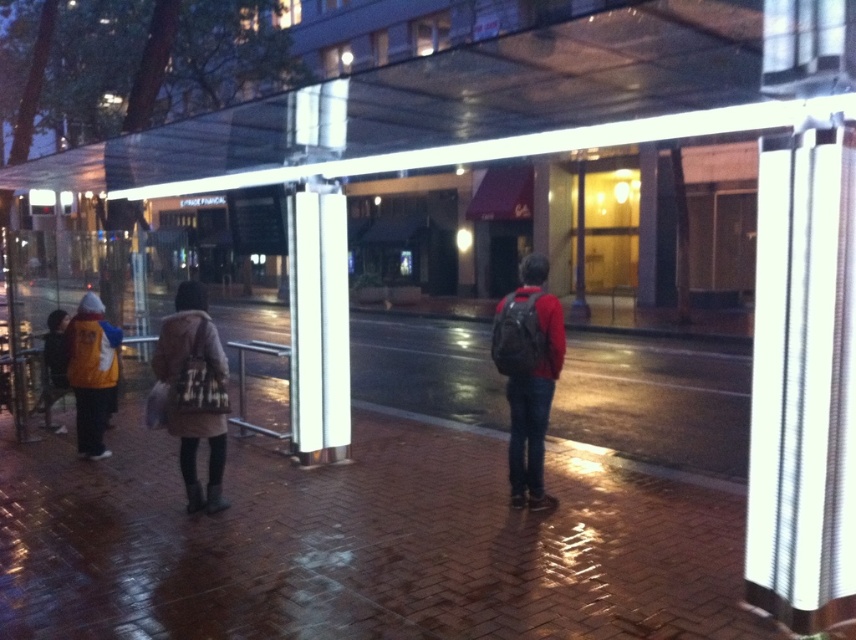
You are a delivery person with a 2.5 meter long package that needs to be transported through the space between the brown fuzzy coat at center and the matte black backpack at center. Can the package fit through the space between them?

The distance between the brown fuzzy coat at center and the matte black backpack at center is 2.40 meters. Since the package is 2.5 meters long, it cannot fit through the space between them as the package is longer than the available space.

You are standing at the bus stop and want to find the brown fuzzy coat at center. Which direction should you look to locate the point at coordinates (192, 392)?

The point at coordinates (192, 392) is on the brown fuzzy coat at center, so look towards the center of the scene to find it.

You are at the bus stop and want to place a small item exactly at the point marked as point (528, 376). Which object should you place it on?

You should place the item on the matte black backpack at center because point (528, 376) is located on that object.